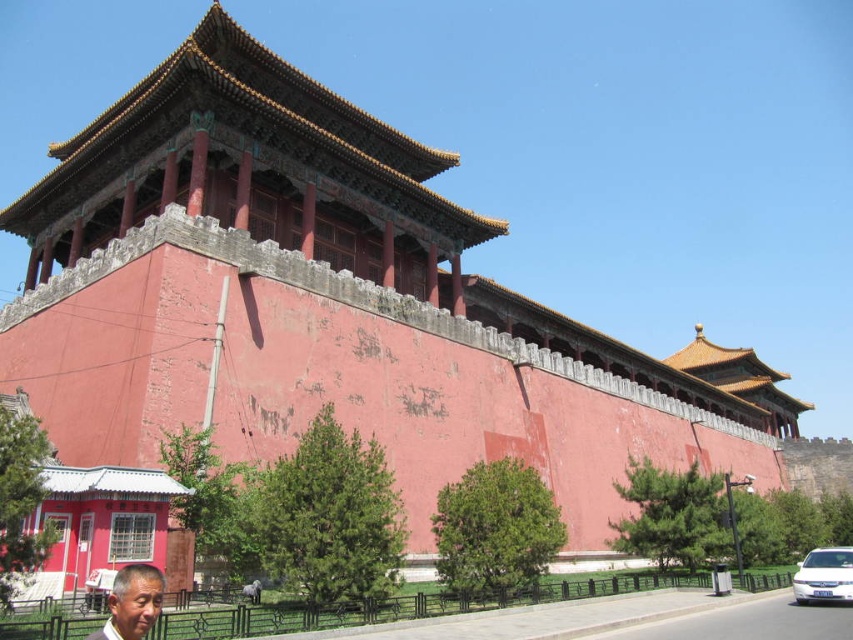
Who is taller, matte gray face at lower left or white glossy minivan at lower right?

white glossy minivan at lower right

Who is more forward, (154, 586) or (824, 570)?

Positioned in front is point (154, 586).

Who is more forward, [91,632] or [813,561]?

Point [91,632] is more forward.

Where is `matte gray face at lower left`? matte gray face at lower left is located at coordinates (x=132, y=602).